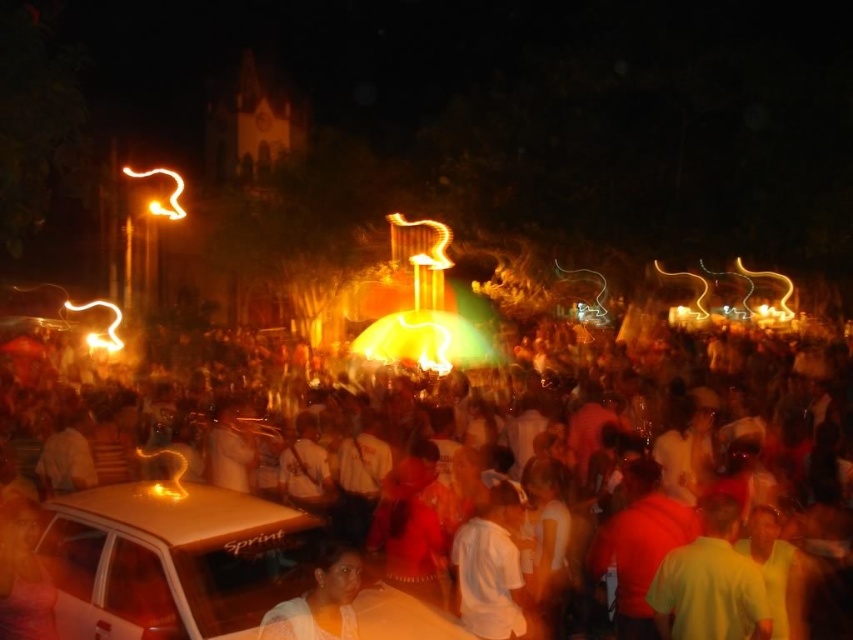
From the picture: You are at the center of the scene and want to move towards the shiny gold car at lower left. Given the coordinates provided, in which general direction should you move?

The shiny gold car at lower left is located at point (170, 561), which means you should move downward and to the left to reach it.

From the picture: You are a photographer trying to capture a photo of the shiny gold car at lower left and the smooth skin face at lower center in the same frame. Based on their heights, which object should you focus on first to ensure both are in focus?

The shiny gold car at lower left is taller than the smooth skin face at lower center, so you should focus on the shiny gold car at lower left first to ensure both are in focus.